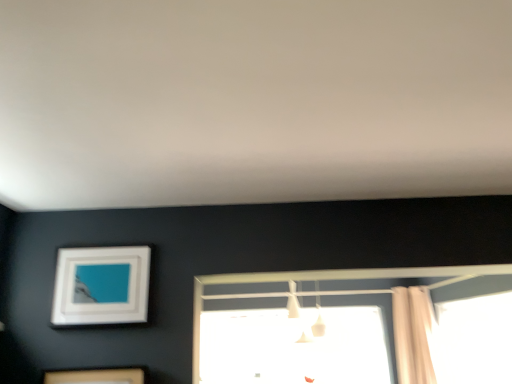
Where is `white matte light fixture at center`? This screenshot has height=384, width=512. white matte light fixture at center is located at coordinates (301, 317).

At what (x,y) coordinates should I click in order to perform the action: click on transparent glass window at center, the 2th window in the front-to-back sequence. Please return your answer as a coordinate pair (x, y). The width and height of the screenshot is (512, 384). Looking at the image, I should click on (294, 346).

This screenshot has width=512, height=384. Identify the location of transparent glass window at center, positioned as the second window in back-to-front order. (475, 339).

Locate an element on the screen. beige fabric shower curtain at right is located at coordinates (413, 335).

There is a white glossy picture frame at upper left. Where is `the 1st window below it (from a real-world perspective)`? the 1st window below it (from a real-world perspective) is located at coordinates (294, 346).

Choose the correct answer: Is white glossy picture frame at upper left inside transparent glass window at center, the 2th window in the front-to-back sequence, or outside it?

white glossy picture frame at upper left is spatially situated outside transparent glass window at center, the 2th window in the front-to-back sequence.

Is white glossy picture frame at upper left bigger than transparent glass window at center, which is the first window in back-to-front order?

No.

From a real-world perspective, which object rests below the other?

transparent glass window at center, which is the first window in back-to-front order, is physically lower.

Is beige fabric shower curtain at right next to white matte light fixture at center?

No.

Does point (414, 294) come in front of point (295, 300)?

That is True.

From a real-world perspective, is beige fabric shower curtain at right physically below white matte light fixture at center?

Indeed, from a real-world perspective, beige fabric shower curtain at right is positioned beneath white matte light fixture at center.

Between beige fabric shower curtain at right and white matte light fixture at center, which one is positioned behind?

Positioned behind is beige fabric shower curtain at right.

The image size is (512, 384). Identify the location of light fixture in front of the beige fabric shower curtain at right. (301, 317).

Does white matte light fixture at center have a greater width compared to beige fabric shower curtain at right?

Answer: Yes.

In the scene shown: From a real-world perspective, does white matte light fixture at center sit lower than beige fabric shower curtain at right?

No, from a real-world perspective, white matte light fixture at center is not below beige fabric shower curtain at right.

Is there a large distance between white matte light fixture at center and beige fabric shower curtain at right?

white matte light fixture at center is positioned a significant distance from beige fabric shower curtain at right.

Based on their positions, is beige fabric shower curtain at right located to the left or right of transparent glass window at center, positioned as the second window in back-to-front order?

From the image, it's evident that beige fabric shower curtain at right is to the left of transparent glass window at center, positioned as the second window in back-to-front order.

Which is in front, point (419, 345) or point (479, 356)?

Point (479, 356)

Based on the photo, is beige fabric shower curtain at right next to transparent glass window at center, arranged as the second window when viewed from the left?

There is a gap between beige fabric shower curtain at right and transparent glass window at center, arranged as the second window when viewed from the left.

Looking at this image, how different are the orientations of beige fabric shower curtain at right and transparent glass window at center, positioned as the first window in front-to-back order, in degrees?

There is a 0.983-degree angle between the facing directions of beige fabric shower curtain at right and transparent glass window at center, positioned as the first window in front-to-back order.

From the image's perspective, relative to beige fabric shower curtain at right, is transparent glass window at center, arranged as the second window when viewed from the left, above or below?

transparent glass window at center, arranged as the second window when viewed from the left, is situated lower than beige fabric shower curtain at right in the image.

Is transparent glass window at center, positioned as the second window in back-to-front order, located outside beige fabric shower curtain at right?

Yes, transparent glass window at center, positioned as the second window in back-to-front order, is not within beige fabric shower curtain at right.

Which object is further away from the camera, transparent glass window at center, the 1th window in the right-to-left sequence, or beige fabric shower curtain at right?

beige fabric shower curtain at right is further from the camera.

Is white matte light fixture at center oriented away from white glossy picture frame at upper left?

No, white matte light fixture at center's orientation is not away from white glossy picture frame at upper left.

Is white matte light fixture at center taller than white glossy picture frame at upper left?

Yes.

Which object is more forward, white matte light fixture at center or white glossy picture frame at upper left?

white glossy picture frame at upper left is closer to the camera.

Is white matte light fixture at center inside or outside of white glossy picture frame at upper left?

white matte light fixture at center is not enclosed by white glossy picture frame at upper left.

From the image's perspective, which object appears higher, transparent glass window at center, which is the first window in back-to-front order, or beige fabric shower curtain at right?

From the image's view, beige fabric shower curtain at right is above.

Could you tell me if transparent glass window at center, which is the first window in back-to-front order, is facing beige fabric shower curtain at right?

No, transparent glass window at center, which is the first window in back-to-front order, is not facing towards beige fabric shower curtain at right.

Which is in front, transparent glass window at center, the 2th window in the front-to-back sequence, or beige fabric shower curtain at right?

beige fabric shower curtain at right.

Does transparent glass window at center, which is the first window in back-to-front order, have a smaller size compared to beige fabric shower curtain at right?

Actually, transparent glass window at center, which is the first window in back-to-front order, might be larger than beige fabric shower curtain at right.

The image size is (512, 384). Find the location of `picture frame above the transparent glass window at center, which is the first window in back-to-front order (from a real-world perspective)`. picture frame above the transparent glass window at center, which is the first window in back-to-front order (from a real-world perspective) is located at coordinates (101, 285).

Locate an element on the screen. shower curtain located on the right of white matte light fixture at center is located at coordinates (413, 335).

Estimate the real-world distances between objects in this image. Which object is further from white glossy picture frame at upper left, transparent glass window at center, positioned as the first window in front-to-back order, or beige fabric shower curtain at right?

Among the two, transparent glass window at center, positioned as the first window in front-to-back order, is located further to white glossy picture frame at upper left.

When comparing their distances from transparent glass window at center, positioned as the second window in back-to-front order, does transparent glass window at center, the 1th window viewed from the left, or white matte light fixture at center seem further?

Among the two, white matte light fixture at center is located further to transparent glass window at center, positioned as the second window in back-to-front order.

Considering their positions, is white matte light fixture at center positioned further to transparent glass window at center, which is the first window in back-to-front order, than transparent glass window at center, positioned as the first window in front-to-back order?

transparent glass window at center, positioned as the first window in front-to-back order.

Looking at this image, looking at the image, which one is located closer to beige fabric shower curtain at right, transparent glass window at center, positioned as the second window in back-to-front order, or white matte light fixture at center?

The object closer to beige fabric shower curtain at right is transparent glass window at center, positioned as the second window in back-to-front order.

Based on their spatial positions, is beige fabric shower curtain at right or transparent glass window at center, the 1th window in the right-to-left sequence, closer to transparent glass window at center, the 2th window in the front-to-back sequence?

Among the two, beige fabric shower curtain at right is located nearer to transparent glass window at center, the 2th window in the front-to-back sequence.

From the image, which object appears to be farther from white glossy picture frame at upper left, transparent glass window at center, the 1th window in the right-to-left sequence, or white matte light fixture at center?

white matte light fixture at center is positioned further to the anchor white glossy picture frame at upper left.

Which object lies further to the anchor point white glossy picture frame at upper left, beige fabric shower curtain at right or transparent glass window at center, the 2th window in the front-to-back sequence?

The object further to white glossy picture frame at upper left is transparent glass window at center, the 2th window in the front-to-back sequence.

From the image, which object appears to be nearer to transparent glass window at center, the 2th window in the front-to-back sequence, transparent glass window at center, positioned as the second window in back-to-front order, or white glossy picture frame at upper left?

Among the two, transparent glass window at center, positioned as the second window in back-to-front order, is located nearer to transparent glass window at center, the 2th window in the front-to-back sequence.

Locate an element on the screen. The height and width of the screenshot is (384, 512). shower curtain between white matte light fixture at center and transparent glass window at center, the 2th window in the front-to-back sequence, in the front-back direction is located at coordinates (413, 335).

Locate an element on the screen. The image size is (512, 384). shower curtain between white matte light fixture at center and transparent glass window at center, positioned as the second window in back-to-front order, from left to right is located at coordinates (413, 335).

At what (x,y) coordinates should I click in order to perform the action: click on window located between white glossy picture frame at upper left and transparent glass window at center, the 1th window viewed from the left, in the depth direction. Please return your answer as a coordinate pair (x, y). Image resolution: width=512 pixels, height=384 pixels. Looking at the image, I should click on (475, 339).

Find the location of a particular element. light fixture located between transparent glass window at center, the 1th window viewed from the left, and transparent glass window at center, positioned as the first window in front-to-back order, in the left-right direction is located at coordinates (301, 317).